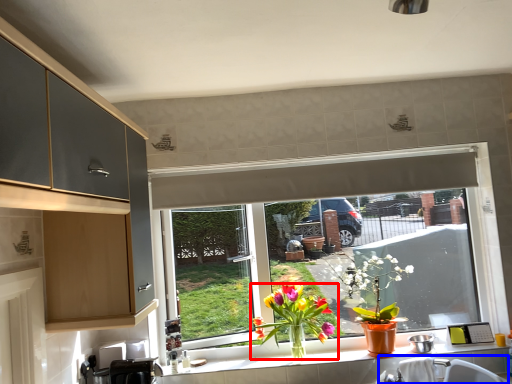
Question: Which object appears farthest to the camera in this image, houseplant (highlighted by a red box) or sink (highlighted by a blue box)?

Choices:
 (A) houseplant
 (B) sink

Answer: (A)